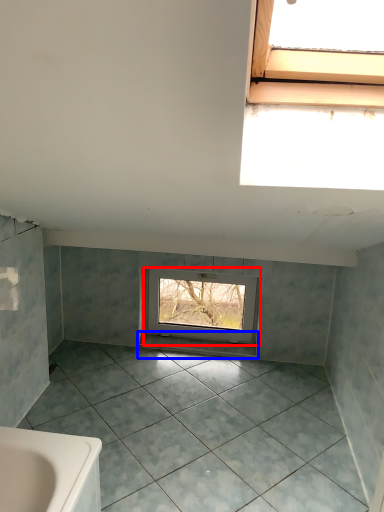
Question: Among these objects, which one is farthest to the camera, window (highlighted by a red box) or window sill (highlighted by a blue box)?

Choices:
 (A) window
 (B) window sill

Answer: (B)